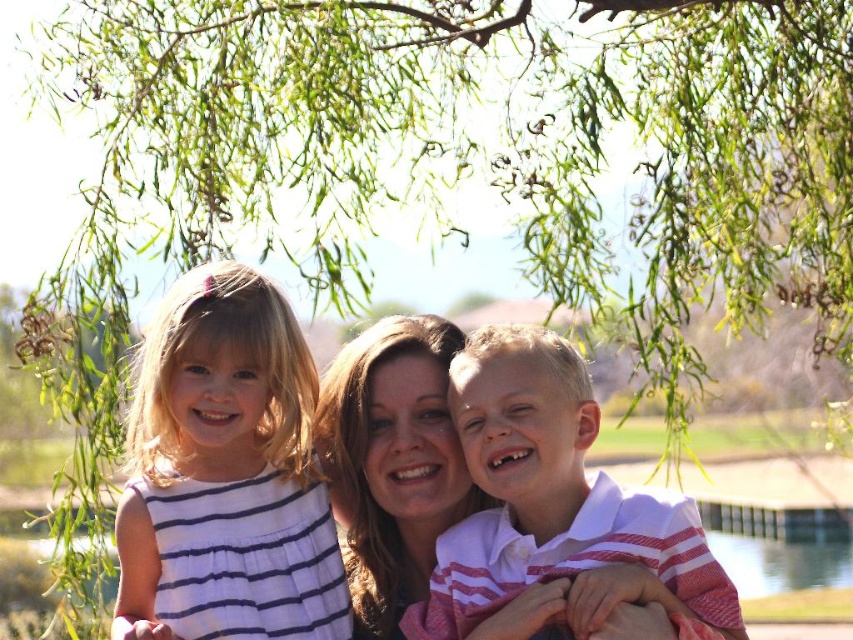
Question: In this image, where is white striped dress at left located relative to white striped shirt at center?

Choices:
 (A) above
 (B) below

Answer: (A)

Question: Which point appears closest to the camera in this image?

Choices:
 (A) (225, 528)
 (B) (474, 376)

Answer: (B)

Question: Which point is farther to the camera?

Choices:
 (A) (312, 508)
 (B) (576, 378)

Answer: (A)

Question: Can you confirm if white striped dress at left is thinner than white striped shirt at center?

Choices:
 (A) yes
 (B) no

Answer: (A)

Question: Among these objects, which one is nearest to the camera?

Choices:
 (A) white striped dress at left
 (B) white striped shirt at center

Answer: (B)

Question: Can you confirm if white striped dress at left is positioned below white striped shirt at center?

Choices:
 (A) yes
 (B) no

Answer: (B)